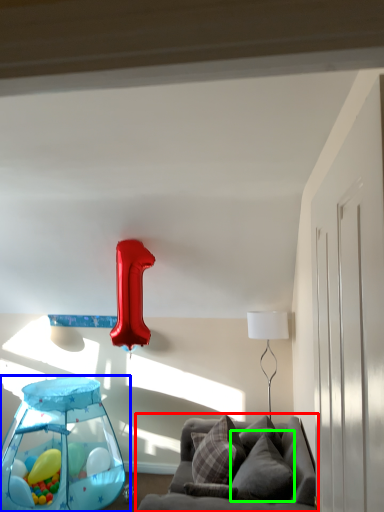
Question: Which object is the closest to the studio couch (highlighted by a red box)? Choose among these: baby carriage (highlighted by a blue box) or pillow (highlighted by a green box).

Choices:
 (A) baby carriage
 (B) pillow

Answer: (B)